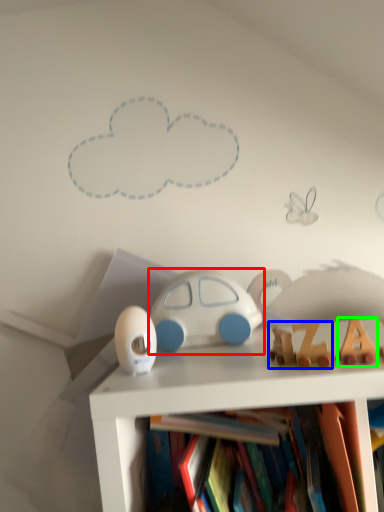
Question: Considering the real-world distances, which object is closest to toy (highlighted by a red box)? toy (highlighted by a blue box) or toy (highlighted by a green box).

Choices:
 (A) toy
 (B) toy

Answer: (A)